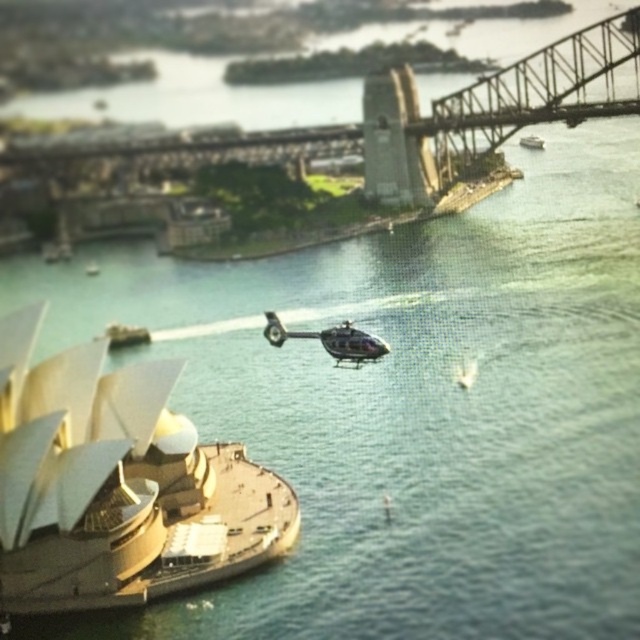
Is white plastic boat at lower left above white plastic boat at upper right?

Incorrect, white plastic boat at lower left is not positioned above white plastic boat at upper right.

This screenshot has height=640, width=640. Identify the location of white plastic boat at lower left. (125, 336).

I want to click on white plastic boat at lower left, so click(x=125, y=336).

Does shiny silver boat at center appear on the left side of white plastic boat at upper right?

Indeed, shiny silver boat at center is positioned on the left side of white plastic boat at upper right.

Is shiny silver boat at center thinner than white plastic boat at upper right?

Incorrect, shiny silver boat at center's width is not less than white plastic boat at upper right's.

Identify the location of shiny silver boat at center. This screenshot has height=640, width=640. (116, 484).

Does shiny silver boat at center have a smaller size compared to metallic helicopter at center?

Incorrect, shiny silver boat at center is not smaller in size than metallic helicopter at center.

Which is in front, point (161, 417) or point (346, 321)?

Point (161, 417) is in front.

Where is `shiny silver boat at center`? The image size is (640, 640). shiny silver boat at center is located at coordinates (116, 484).

Locate an element on the screen. The image size is (640, 640). shiny silver boat at center is located at coordinates 116,484.